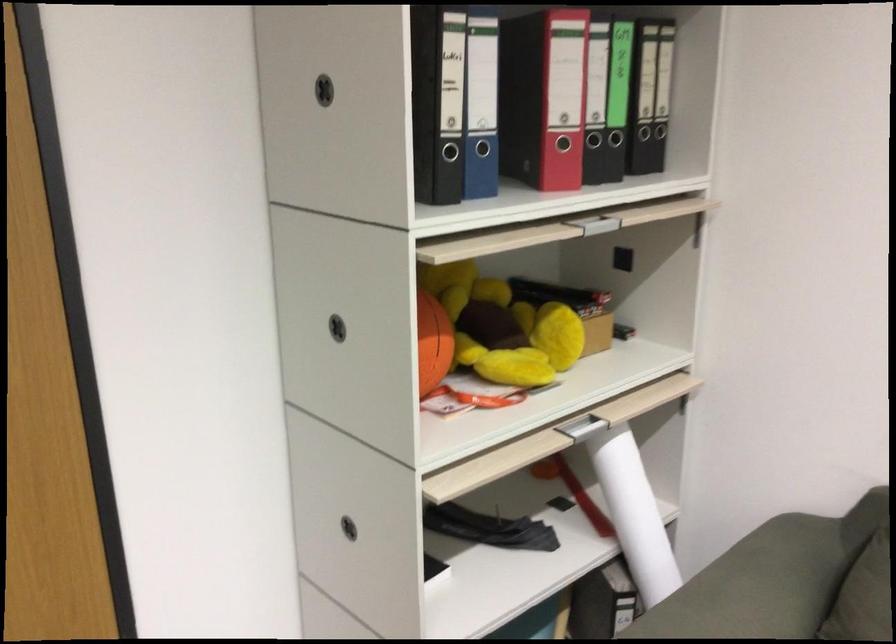
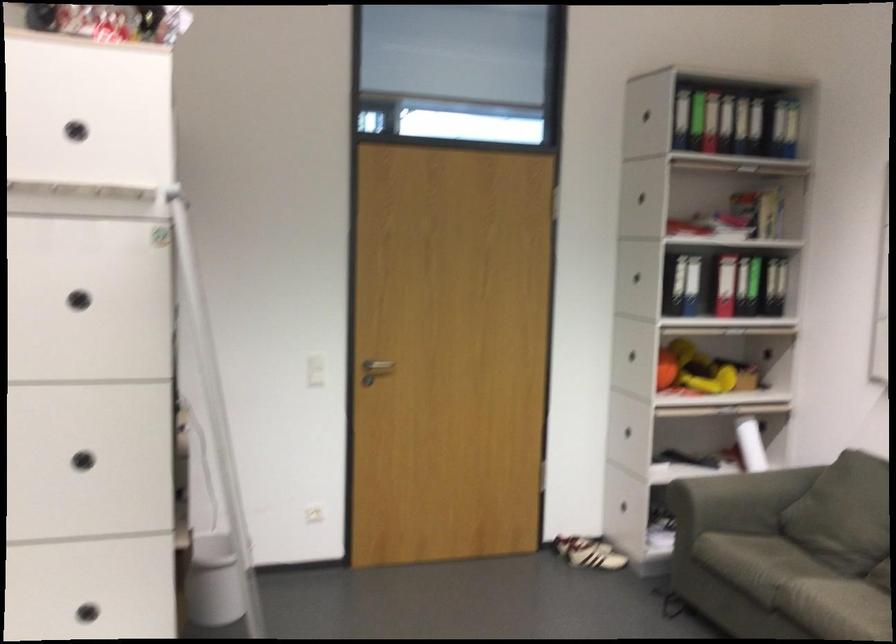
Find the pixel in the second image that matches point (645, 506) in the first image.

(750, 444)